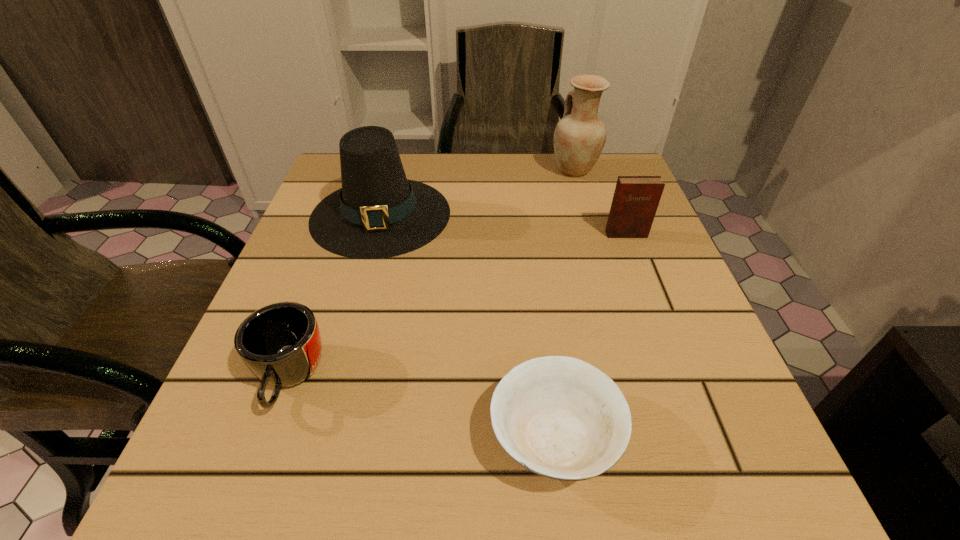
Identify the location of empty space that is in between the tallest object and the fourth tallest object. This screenshot has height=540, width=960. (432, 273).

You are a GUI agent. You are given a task and a screenshot of the screen. Output one action in this format:
    pyautogui.click(x=<x>, y=<y>)
    Task: Click on the vacant area between the tallest object and the bowl
    
    Given the screenshot: What is the action you would take?
    pyautogui.click(x=564, y=303)

At what (x,y) coordinates should I click in order to perform the action: click on vacant space in between the tallest object and the diary. Please return your answer as a coordinate pair (x, y). This screenshot has width=960, height=540. Looking at the image, I should click on (600, 202).

You are a GUI agent. You are given a task and a screenshot of the screen. Output one action in this format:
    pyautogui.click(x=<x>, y=<y>)
    Task: Click on the vacant space that is in between the tallest object and the bowl
    This screenshot has height=540, width=960.
    Given the screenshot: What is the action you would take?
    pyautogui.click(x=564, y=303)

The image size is (960, 540). Find the location of `empty space between the bowl and the diary`. empty space between the bowl and the diary is located at coordinates [x=589, y=335].

Identify the location of vacant space that's between the shortest object and the pottery. Image resolution: width=960 pixels, height=540 pixels. (564, 303).

Find the location of a particular element. object that is the second closest to the bowl is located at coordinates (378, 213).

Identify which object is located as the nearest to the mug. Please provide its 2D coordinates. Your answer should be formatted as a tuple, i.e. [(x, y)], where the tuple contains the x and y coordinates of a point satisfying the conditions above.

[(378, 213)]

This screenshot has width=960, height=540. In order to click on free spot that satisfies the following two spatial constraints: 1. on the side of the second shortest object with the handle; 2. on the left side of the shortest object in this screenshot , I will do `click(268, 436)`.

Image resolution: width=960 pixels, height=540 pixels. I want to click on vacant space that satisfies the following two spatial constraints: 1. on the front-facing side of the fourth shortest object; 2. on the right side of the bowl, so click(320, 436).